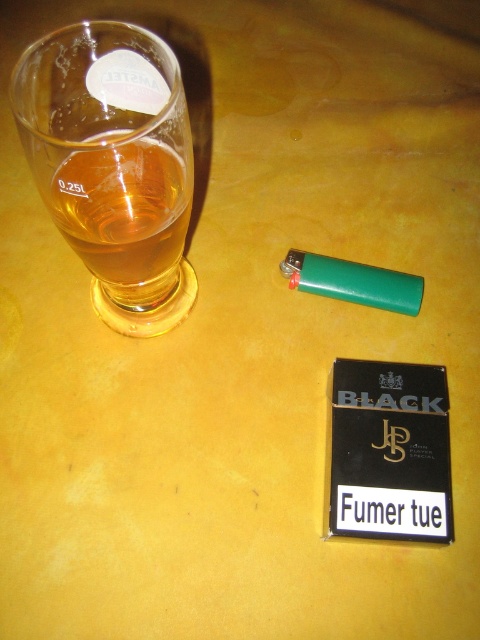
Question: Is transparent glass beer at left bigger than translucent amber liquid at left?

Choices:
 (A) yes
 (B) no

Answer: (A)

Question: Does transparent glass beer at left lie behind translucent amber liquid at left?

Choices:
 (A) no
 (B) yes

Answer: (A)

Question: Can you confirm if transparent glass beer at left is thinner than translucent amber liquid at left?

Choices:
 (A) no
 (B) yes

Answer: (A)

Question: Which object appears farthest from the camera in this image?

Choices:
 (A) translucent amber liquid at left
 (B) transparent glass beer at left

Answer: (A)